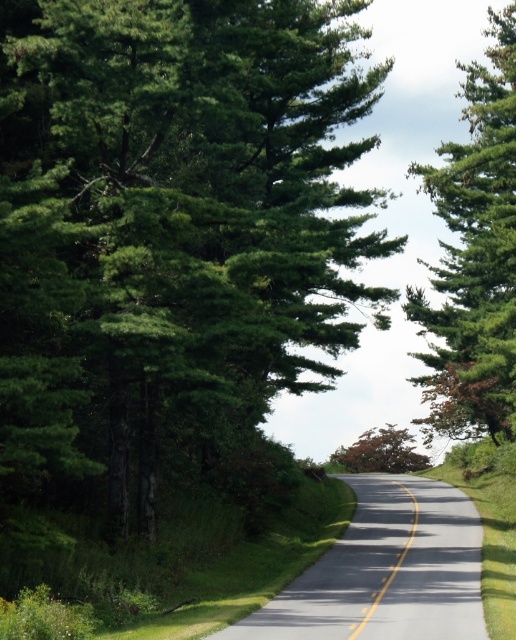
Question: Considering the real-world distances, which object is closest to the green matte tree at left?

Choices:
 (A) yellow solid line at center
 (B) green matte tree at center

Answer: (B)

Question: Does green matte tree at left appear over yellow solid line at center?

Choices:
 (A) no
 (B) yes

Answer: (B)

Question: Which of these objects is positioned farthest from the green matte tree at center?

Choices:
 (A) green matte tree at left
 (B) brown textured tree at center
 (C) yellow solid line at center

Answer: (C)

Question: Among these objects, which one is farthest from the camera?

Choices:
 (A) brown textured tree at center
 (B) yellow solid line at center
 (C) green matte tree at left
 (D) green matte tree at center

Answer: (A)

Question: Can you confirm if green matte tree at left is positioned above yellow solid line at center?

Choices:
 (A) yes
 (B) no

Answer: (A)

Question: Observing the image, what is the correct spatial positioning of brown textured tree at center in reference to yellow solid line at center?

Choices:
 (A) right
 (B) left

Answer: (A)